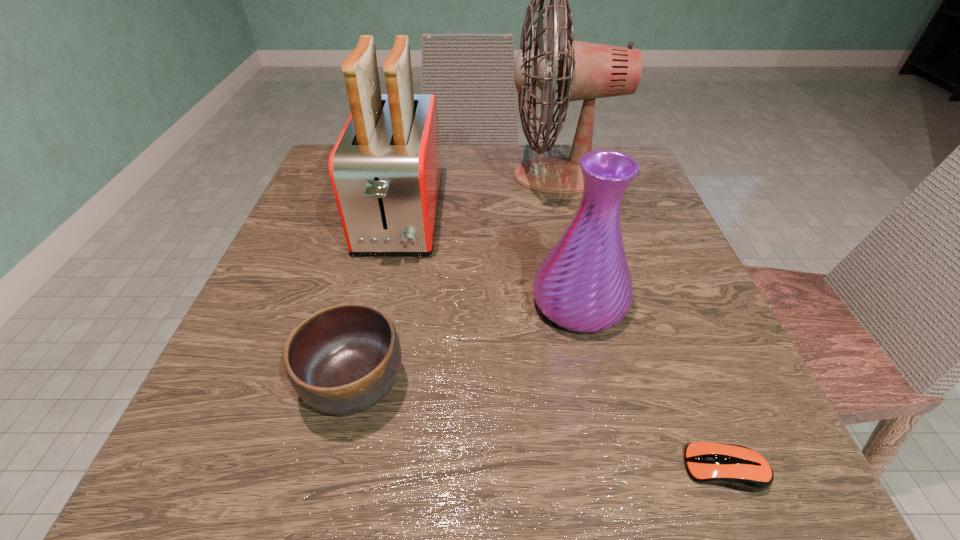
Image resolution: width=960 pixels, height=540 pixels. In order to click on bowl that is positioned at the left edge in this screenshot , I will do `click(343, 359)`.

You are a GUI agent. You are given a task and a screenshot of the screen. Output one action in this format:
    pyautogui.click(x=<x>, y=<y>)
    Task: Click on the fan present at the right edge
    
    Given the screenshot: What is the action you would take?
    pyautogui.click(x=585, y=71)

I want to click on vase positioned at the right edge, so click(x=584, y=284).

Locate an element on the screen. computer mouse that is at the right edge is located at coordinates (737, 467).

Where is `object located in the far left corner section of the desktop`? Image resolution: width=960 pixels, height=540 pixels. object located in the far left corner section of the desktop is located at coordinates (385, 169).

I want to click on object that is at the near left corner, so click(x=343, y=359).

Where is `object that is at the far right corner`? object that is at the far right corner is located at coordinates (585, 71).

At what (x,y) coordinates should I click in order to perform the action: click on object situated at the near right corner. Please return your answer as a coordinate pair (x, y). The height and width of the screenshot is (540, 960). Looking at the image, I should click on (737, 467).

The image size is (960, 540). I want to click on vacant region at the near edge of the desktop, so click(x=528, y=460).

Where is `vacant space at the left edge`? The image size is (960, 540). vacant space at the left edge is located at coordinates (255, 367).